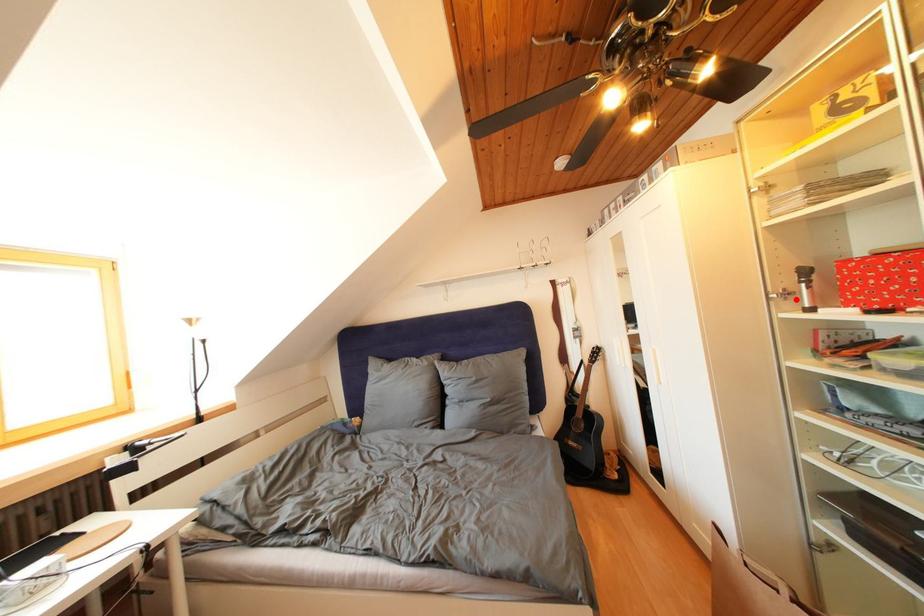
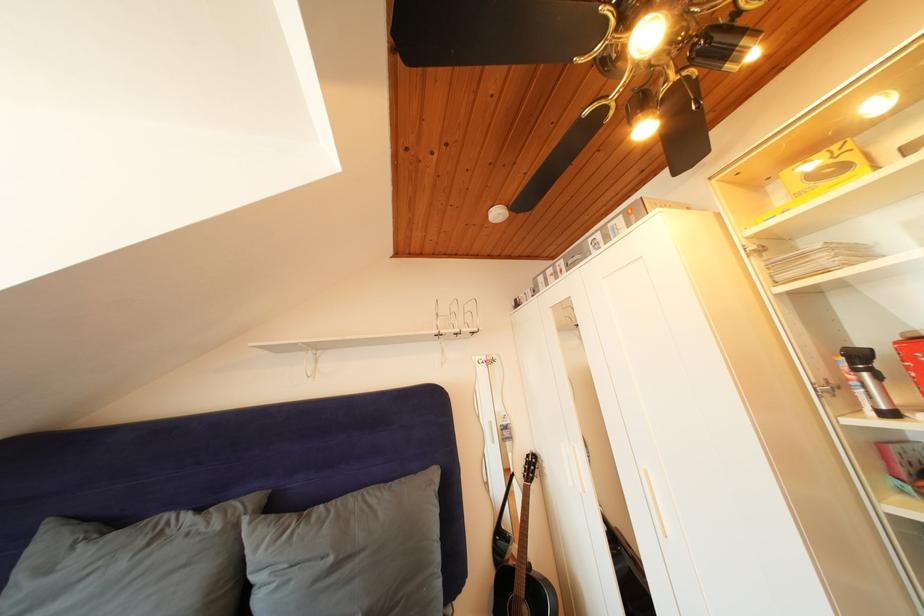
The point at the highlighted location is marked in the first image. Where is the corresponding point in the second image?

(844, 392)